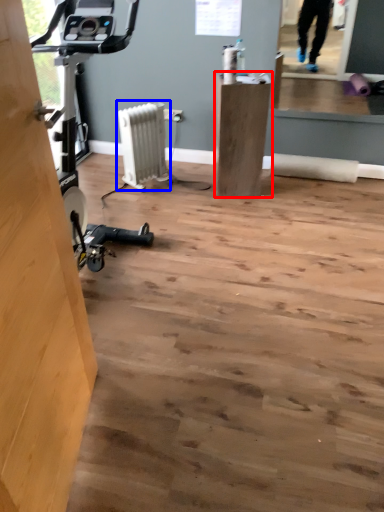
Question: Which of the following is the closest to the observer, furniture (highlighted by a red box) or radiator (highlighted by a blue box)?

Choices:
 (A) furniture
 (B) radiator

Answer: (A)